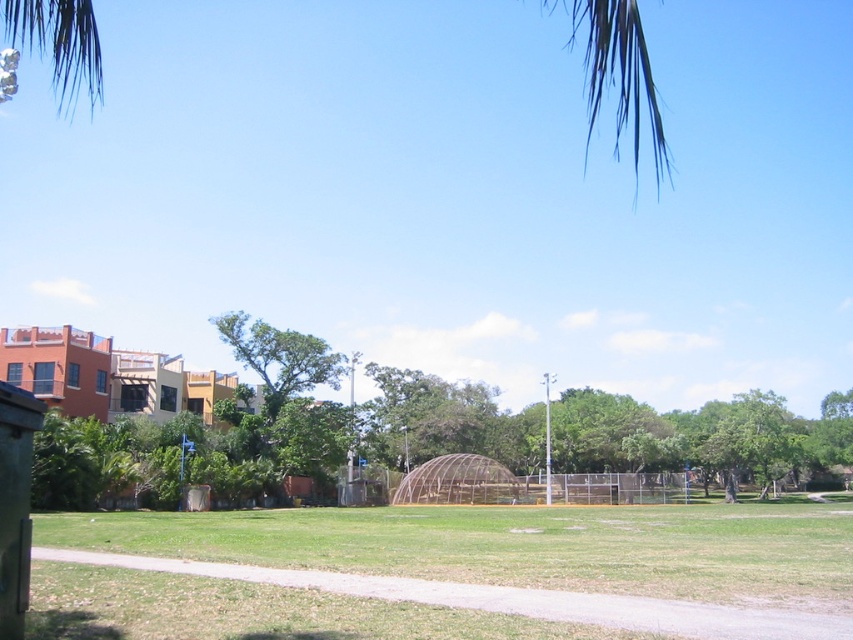
You are standing in the park and want to reach the point marked at coordinates (x=228, y=621). The paved pathway is 2 meters wide. Can you walk directly to that point without stepping off the pathway?

The point marked at coordinates (x=228, y=621) is 7.88 meters away from you. Since the pathway is 2 meters wide, you can walk directly to that point without leaving the pathway as long as the point lies within the pathway area. However, the exact position of the point relative to the pathway isn

You are a gardener who needs to mow the lawn. You see the green grass at center and the green leafy palm tree at upper left. Which area requires mowing, and why?

The green grass at center requires mowing because it has a lesser height compared to the green leafy palm tree at upper left, indicating it needs trimming.